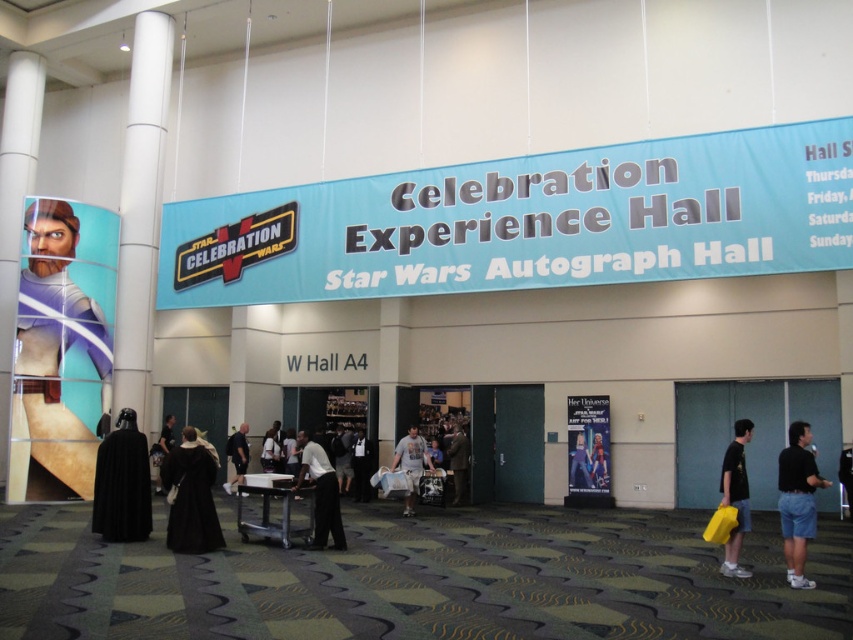
Question: Which of the following is the farthest from the observer?

Choices:
 (A) (461, 477)
 (B) (339, 476)
 (C) (412, 448)

Answer: (B)

Question: Which of the following is the farthest from the observer?

Choices:
 (A) (793, 508)
 (B) (740, 573)
 (C) (279, 449)
 (D) (410, 508)

Answer: (C)

Question: Observing the image, what is the correct spatial positioning of black velvet cape at lower left in reference to dark gray fabric shirt at center?

Choices:
 (A) left
 (B) right

Answer: (A)

Question: Which of the following is the farthest from the observer?

Choices:
 (A) (337, 444)
 (B) (746, 440)
 (C) (331, 492)
 (D) (459, 497)

Answer: (A)

Question: Is black velvet cape at lower left above metallic silver helmet at center?

Choices:
 (A) no
 (B) yes

Answer: (B)

Question: Can you confirm if metallic silver poster at center is positioned below gray cotton t-shirt at center?

Choices:
 (A) no
 (B) yes

Answer: (A)